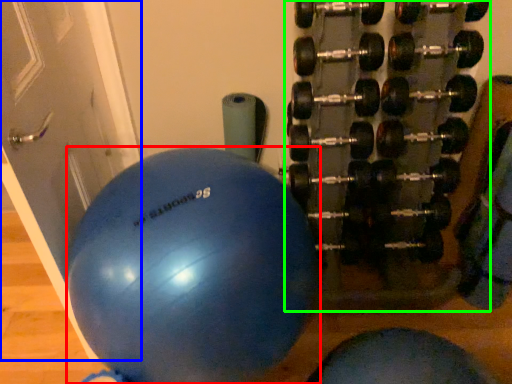
Question: Which object is positioned closest to ball (highlighted by a red box)? Select from door (highlighted by a blue box) and dumbbell (highlighted by a green box).

Choices:
 (A) door
 (B) dumbbell

Answer: (A)